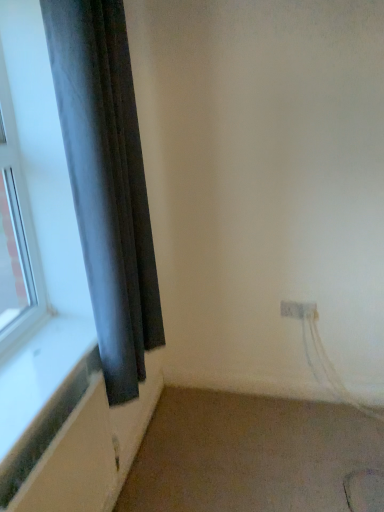
Question: Can you confirm if beige carpet at lower right is positioned to the left of white plastic electric outlet at lower right?

Choices:
 (A) no
 (B) yes

Answer: (B)

Question: Is beige carpet at lower right oriented away from white plastic electric outlet at lower right?

Choices:
 (A) no
 (B) yes

Answer: (A)

Question: Can you confirm if beige carpet at lower right is shorter than white plastic electric outlet at lower right?

Choices:
 (A) no
 (B) yes

Answer: (B)

Question: Is white plastic electric outlet at lower right surrounded by beige carpet at lower right?

Choices:
 (A) no
 (B) yes

Answer: (A)

Question: Considering the relative sizes of beige carpet at lower right and white plastic electric outlet at lower right in the image provided, is beige carpet at lower right bigger than white plastic electric outlet at lower right?

Choices:
 (A) yes
 (B) no

Answer: (A)

Question: Is beige carpet at lower right thinner than white plastic electric outlet at lower right?

Choices:
 (A) yes
 (B) no

Answer: (B)

Question: Is beige carpet at lower right at the back of dark gray fabric curtain at left?

Choices:
 (A) no
 (B) yes

Answer: (A)

Question: Can you confirm if dark gray fabric curtain at left is positioned to the left of beige carpet at lower right?

Choices:
 (A) yes
 (B) no

Answer: (A)

Question: Can you confirm if dark gray fabric curtain at left is wider than beige carpet at lower right?

Choices:
 (A) yes
 (B) no

Answer: (B)

Question: Is beige carpet at lower right a part of dark gray fabric curtain at left?

Choices:
 (A) no
 (B) yes

Answer: (A)

Question: Is dark gray fabric curtain at left directly adjacent to beige carpet at lower right?

Choices:
 (A) no
 (B) yes

Answer: (A)

Question: Is the depth of dark gray fabric curtain at left greater than that of beige carpet at lower right?

Choices:
 (A) no
 (B) yes

Answer: (A)

Question: Is beige carpet at lower right to the left of dark gray fabric curtain at left from the viewer's perspective?

Choices:
 (A) no
 (B) yes

Answer: (A)